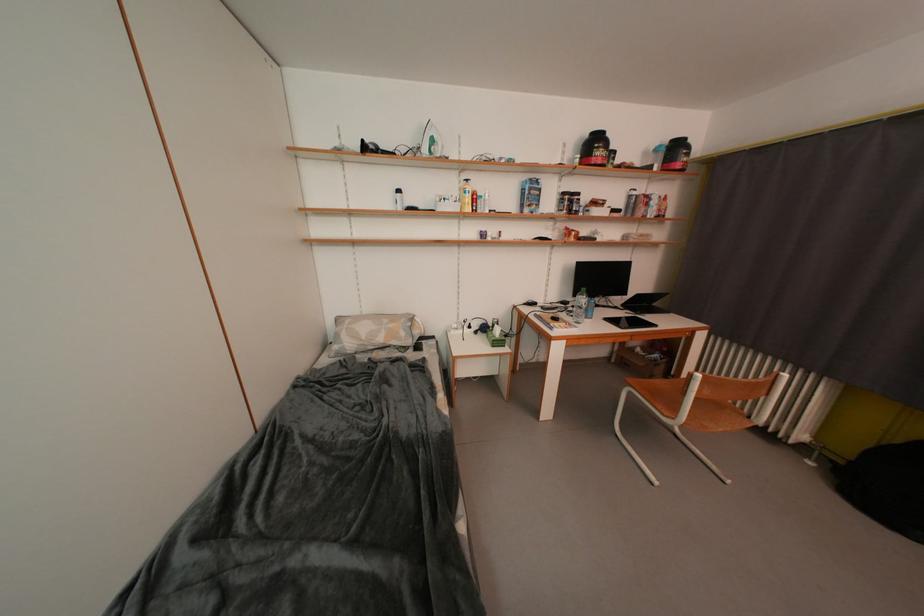
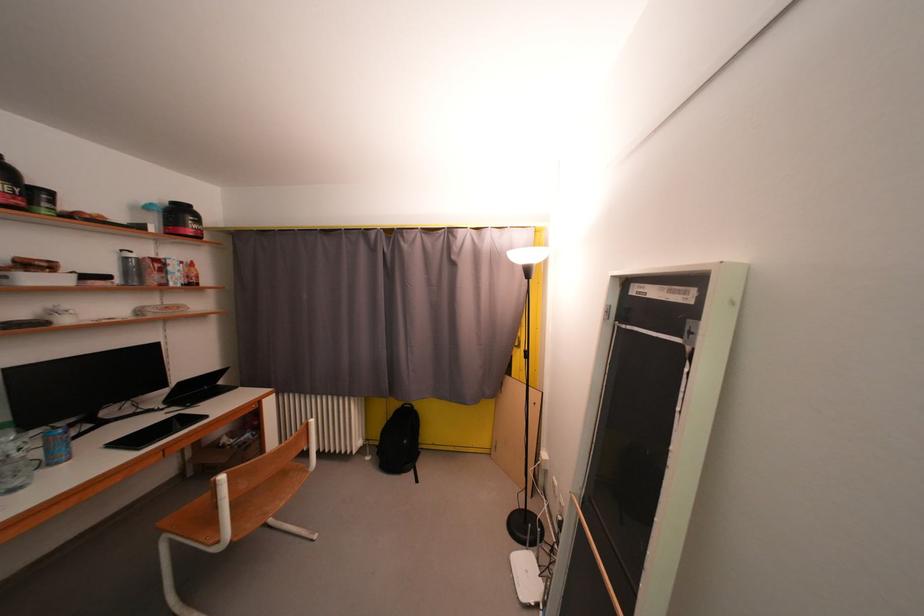
Locate, in the second image, the point that corresponds to point (630, 309) in the first image.

(174, 405)